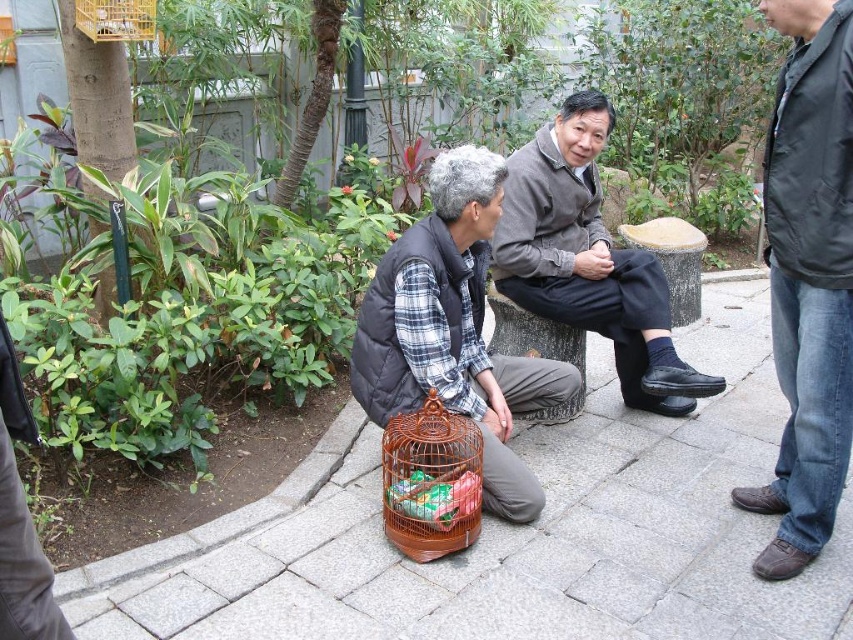
Which of these two, brown wire birdcage at lower center or brown woven birdcage at lower center, stands shorter?

brown woven birdcage at lower center

Who is taller, brown wire birdcage at lower center or brown woven birdcage at lower center?

With more height is brown wire birdcage at lower center.

Who is more forward, (x=471, y=394) or (x=410, y=438)?

Point (x=410, y=438) is in front.

Where is `brown wire birdcage at lower center`? This screenshot has height=640, width=853. brown wire birdcage at lower center is located at coordinates (453, 330).

Can you confirm if black matte jacket at right is positioned to the right of wooden birdcage at upper left?

Yes, black matte jacket at right is to the right of wooden birdcage at upper left.

Looking at this image, who is lower down, black matte jacket at right or wooden birdcage at upper left?

black matte jacket at right

The image size is (853, 640). What are the coordinates of `black matte jacket at right` in the screenshot? It's located at (808, 278).

Who is higher up, brown wire birdcage at lower center or gray wool sweater at center?

gray wool sweater at center is above.

Which is behind, point (364, 317) or point (599, 324)?

Point (599, 324)

Locate an element on the screen. The height and width of the screenshot is (640, 853). brown wire birdcage at lower center is located at coordinates tap(453, 330).